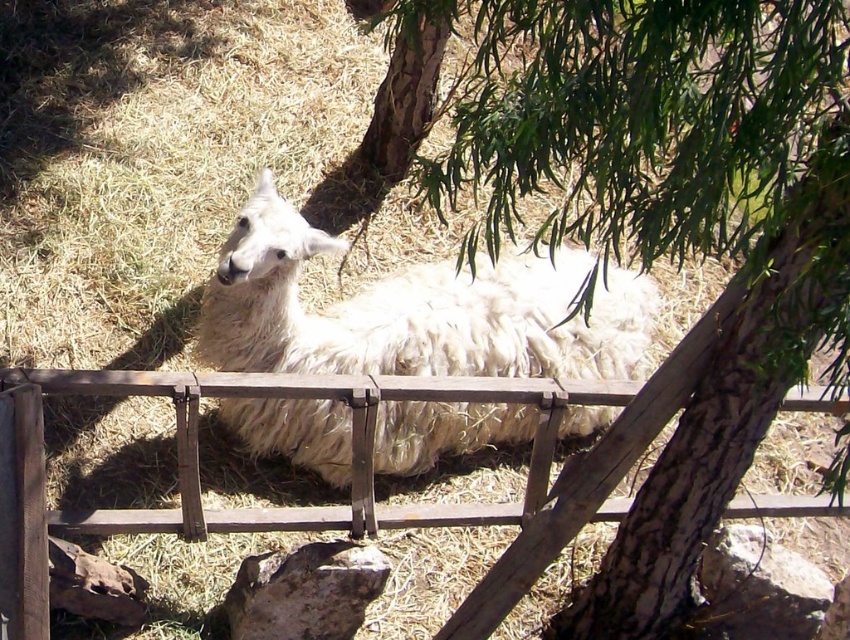
You are a zookeeper who needs to check the wooden gate at center. However, the white fluffy alpaca at center is blocking your path. Can you walk under the alpaca to reach the gate?

The white fluffy alpaca at center is above the wooden gate at center, so you can walk under the alpaca to reach the wooden gate at center.

You are a zookeeper who needs to feed the white fluffy alpaca at center. The wooden gate at center is the only entrance to its enclosure. Can you reach the alpaca without opening the gate?

The white fluffy alpaca at center is positioned on the right side of wooden gate at center, so the gate is between you and the alpaca. Therefore, you need to open the gate to reach the alpaca.

You are a photographer trying to capture a photo of the white fluffy alpaca at center and the green leafy tree at center. If you want to ensure both are fully visible in the frame, which one should you focus on to avoid cropping either?

You should focus on the white fluffy alpaca at center because the green leafy tree at center is narrower than the white fluffy alpaca at center, so the tree will fit within the frame if the alpaca is centered.